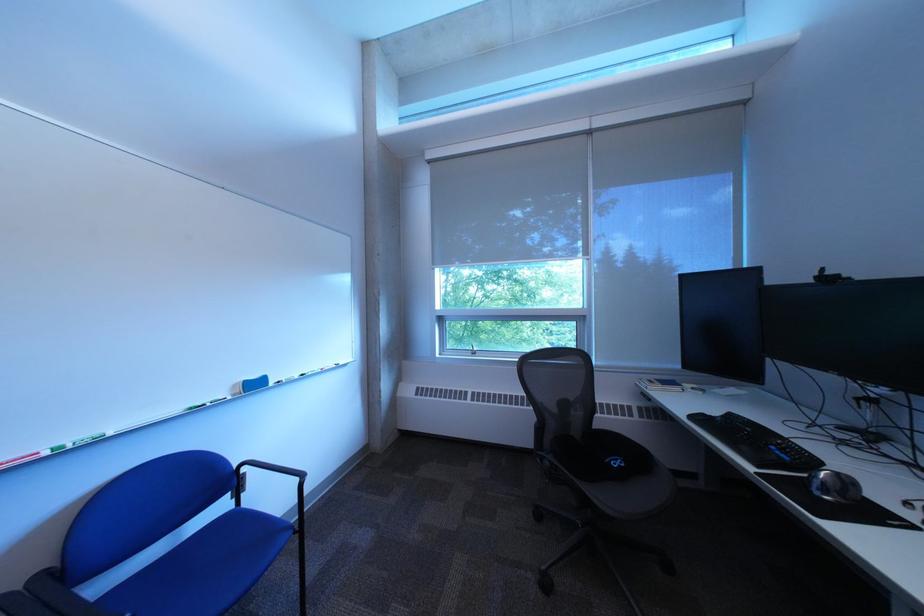
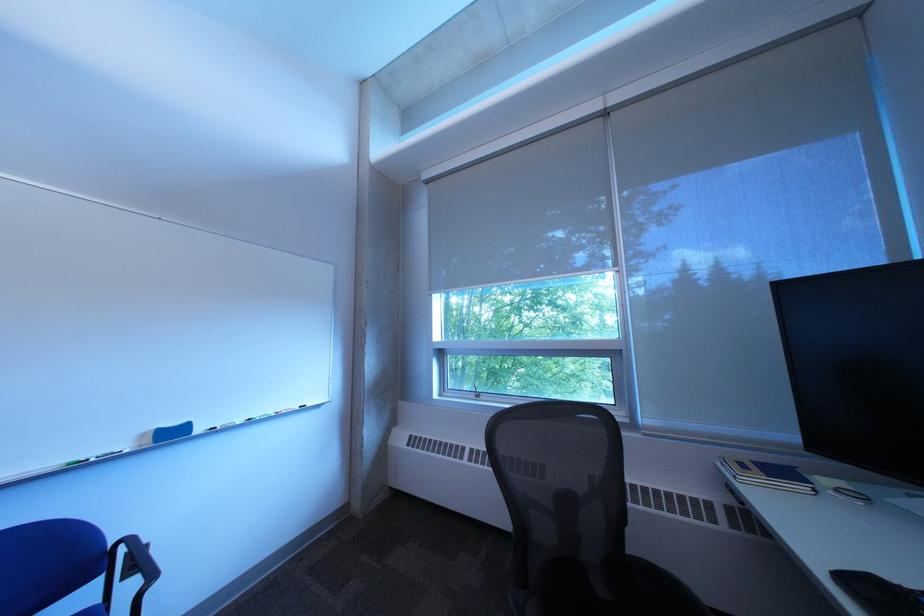
In the second image, find the point that corresponds to (x=562, y=246) in the first image.

(611, 267)